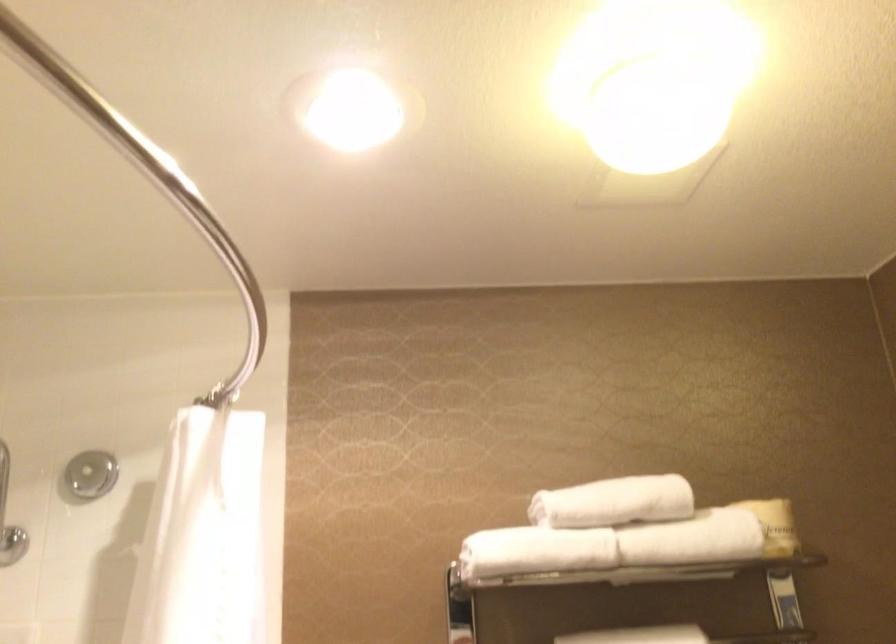
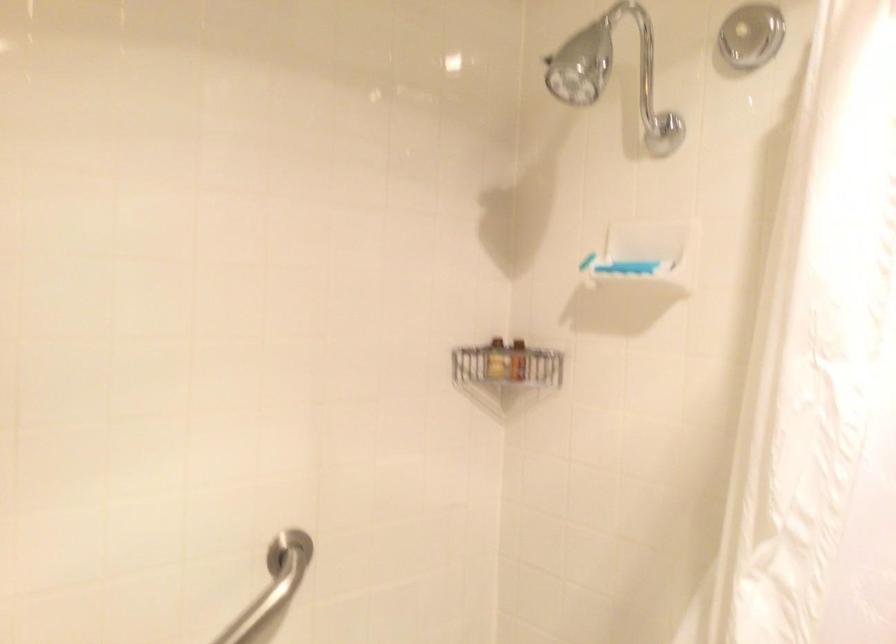
The first image is from the beginning of the video and the second image is from the end. How did the camera likely rotate when shooting the video?

The camera's rotation is toward left-down.